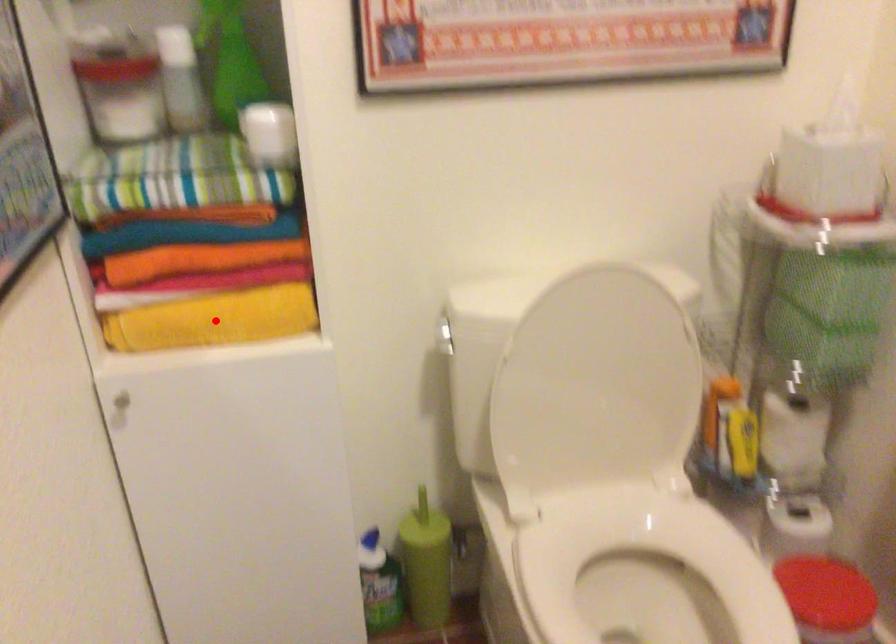
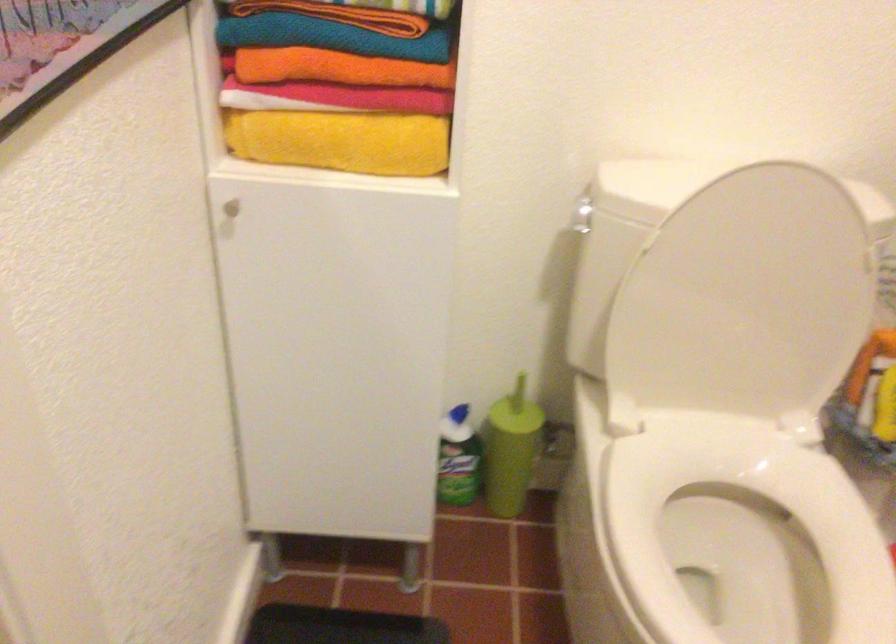
Locate, in the second image, the point that corresponds to the highlighted location in the first image.

(341, 140)